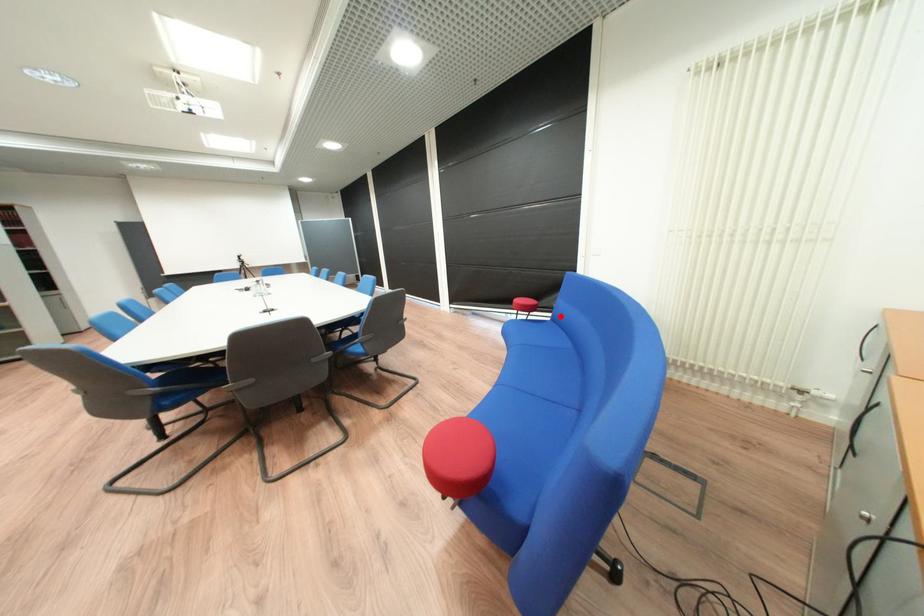
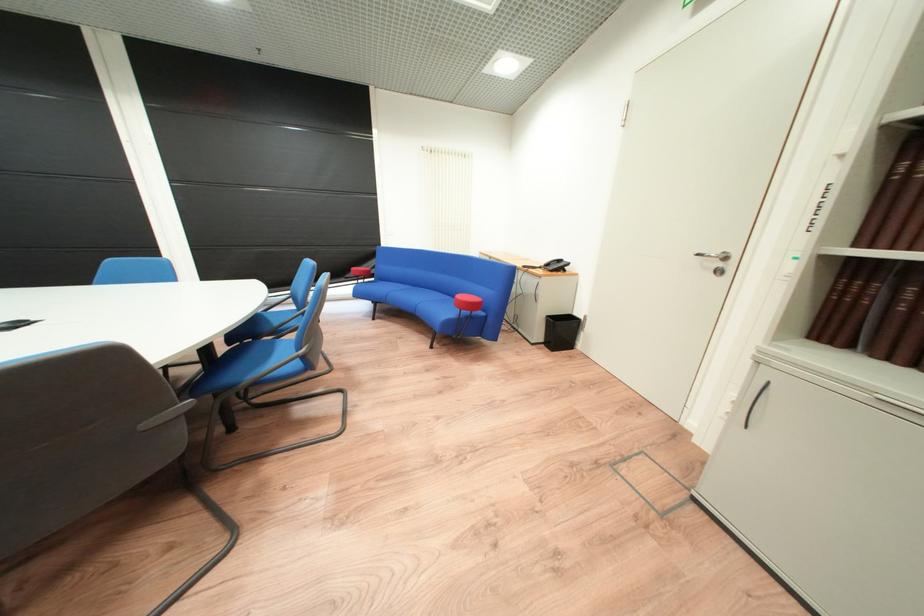
Locate, in the second image, the point that corresponds to the highlighted location in the first image.

(383, 280)